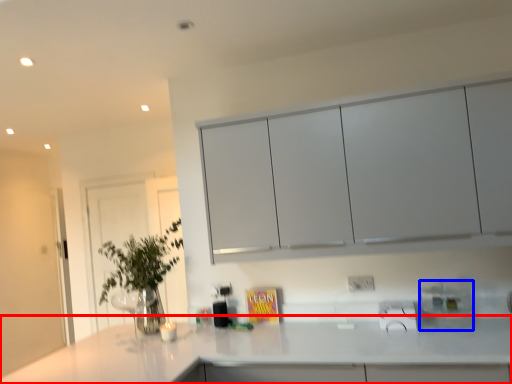
Question: Which point is further to the camera, countertop (highlighted by a red box) or appliance (highlighted by a blue box)?

Choices:
 (A) countertop
 (B) appliance

Answer: (B)